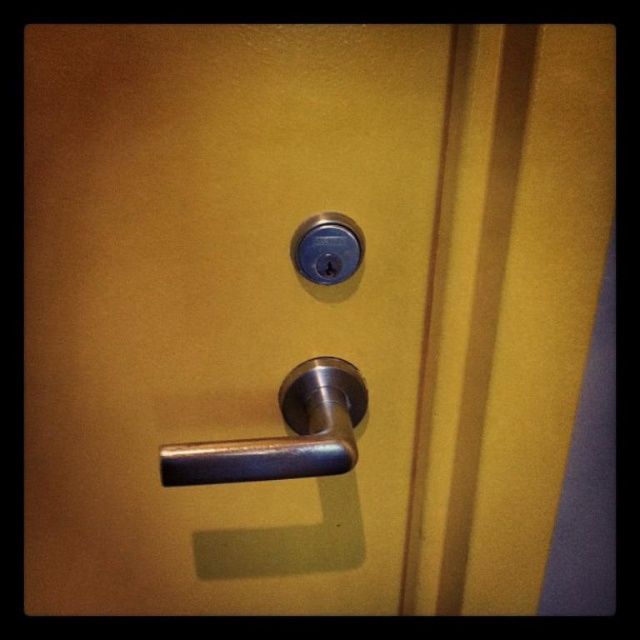
Based on the photo, you need to open the door but can only reach objects within 1 meter. The polished metal door handle at center and the satin nickel lock at center are both at the same height. Which object can you reach more easily?

The polished metal door handle at center has a larger size compared to the satin nickel lock at center, so it can be reached more easily since it is bigger and easier to grasp within the 1 meter reach.

You are trying to locate the handle on the door. According to the image, where exactly is the metallic silver handle at center positioned?

The metallic silver handle at center is located at point coordinates of 0.477 on the x axis and 0.341 on the y axis.